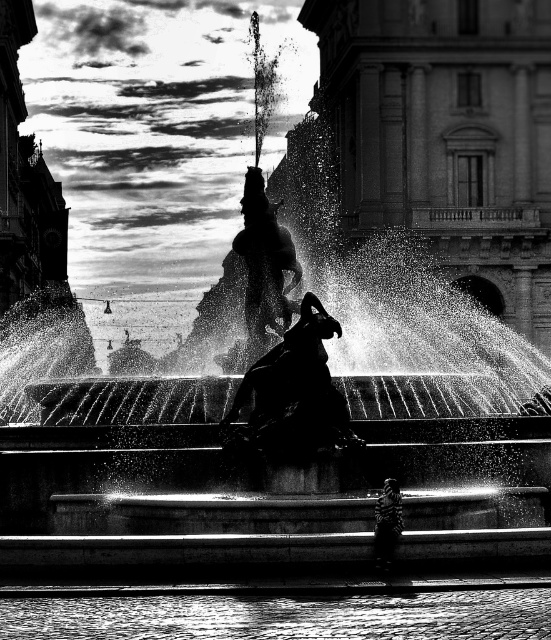
Which is above, smooth stone statue at center or silhouette stone statue at center?

silhouette stone statue at center

Does point (260, 396) lie in front of point (261, 300)?

Yes, it is.

Locate an element on the screen. Image resolution: width=551 pixels, height=640 pixels. smooth stone statue at center is located at coordinates (295, 390).

Which is more to the left, silhouette stone statue at center or zebra-striped fabric at lower center?

From the viewer's perspective, silhouette stone statue at center appears more on the left side.

Is point (269, 317) less distant than point (386, 513)?

No.

Locate an element on the screen. Image resolution: width=551 pixels, height=640 pixels. silhouette stone statue at center is located at coordinates (264, 259).

Is smooth stone statue at center wider than zebra-striped fabric at lower center?

Yes, smooth stone statue at center is wider than zebra-striped fabric at lower center.

This screenshot has height=640, width=551. I want to click on smooth stone statue at center, so click(295, 390).